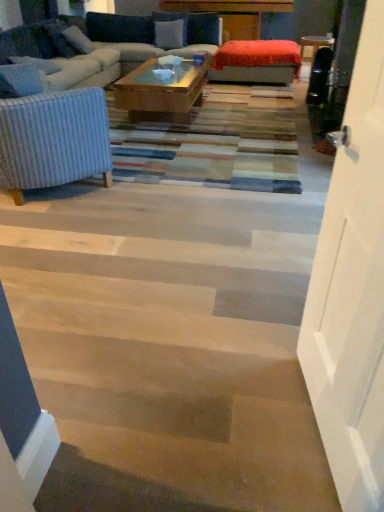
This screenshot has width=384, height=512. What are the coordinates of `vacant space underneath white wood door at right (from a real-world perspective)` in the screenshot? It's located at (312, 421).